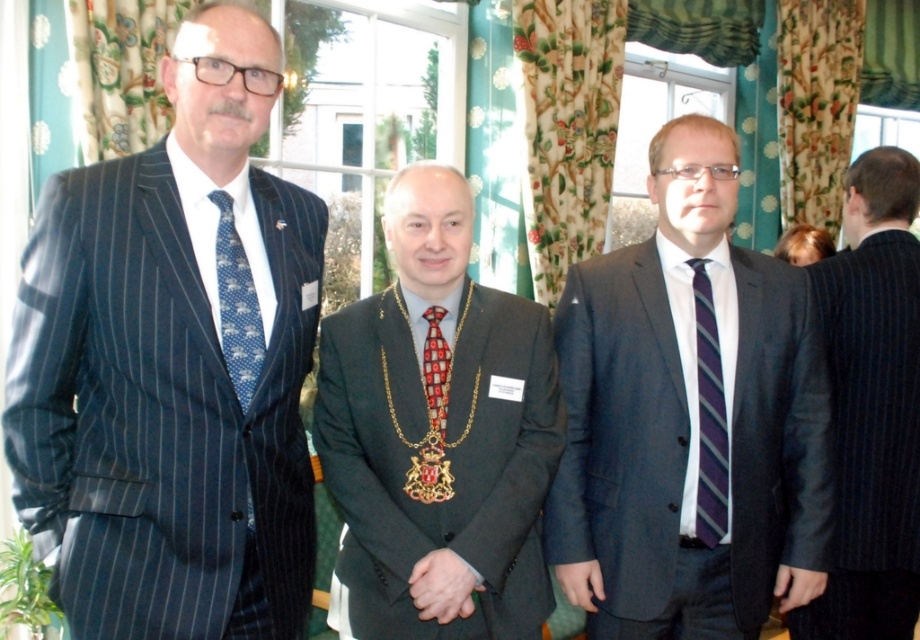
Question: Can you confirm if matte pinstripe suit at left is positioned above matte black suit at center?

Choices:
 (A) no
 (B) yes

Answer: (B)

Question: Which point is closer to the camera?

Choices:
 (A) red textured fabric tie at center
 (B) shiny black suit at center
 (C) matte black suit at center
 (D) blue dotted tie at left

Answer: (D)

Question: Does dark pinstripe suit at right come behind blue dotted tie at left?

Choices:
 (A) no
 (B) yes

Answer: (B)

Question: Is dark pinstripe suit at right positioned at the back of blue dotted tie at left?

Choices:
 (A) yes
 (B) no

Answer: (A)

Question: Which point is closer to the camera?

Choices:
 (A) red textured fabric tie at center
 (B) shiny black suit at center

Answer: (B)

Question: Among these objects, which one is farthest from the camera?

Choices:
 (A) red textured fabric tie at center
 (B) blue dotted tie at left
 (C) shiny black suit at center
 (D) matte black suit at center

Answer: (D)